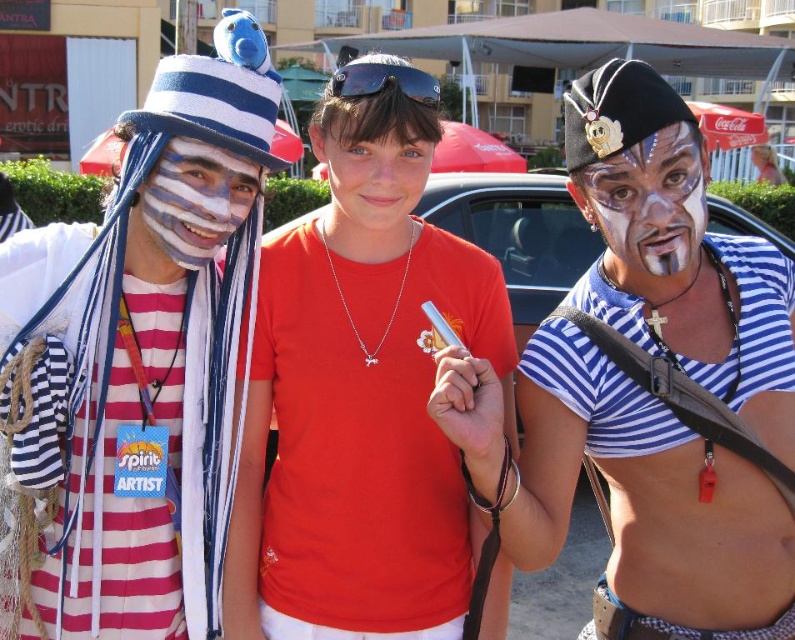
You are a photographer at the event and need to capture a clear shot of both the striped fabric sailor hat at left and the matte striped face at center. Based on their positions, which one will appear lower in the photo?

The striped fabric sailor hat at left appears lower in the photo because it is positioned below the matte striped face at center.

You are a photographer trying to capture a closeup of the striped fabric sailor hat at left and the matte striped face at center. Which object should you zoom in more on to ensure both are in focus?

Since the striped fabric sailor hat at left is bigger than the matte striped face at center, you should zoom in more on the matte striped face at center to ensure both are in focus.

In the scene shown: What is located at the coordinates point (650, 387) in the image?

The point (650, 387) is where the matte black pirate hat at center is located.